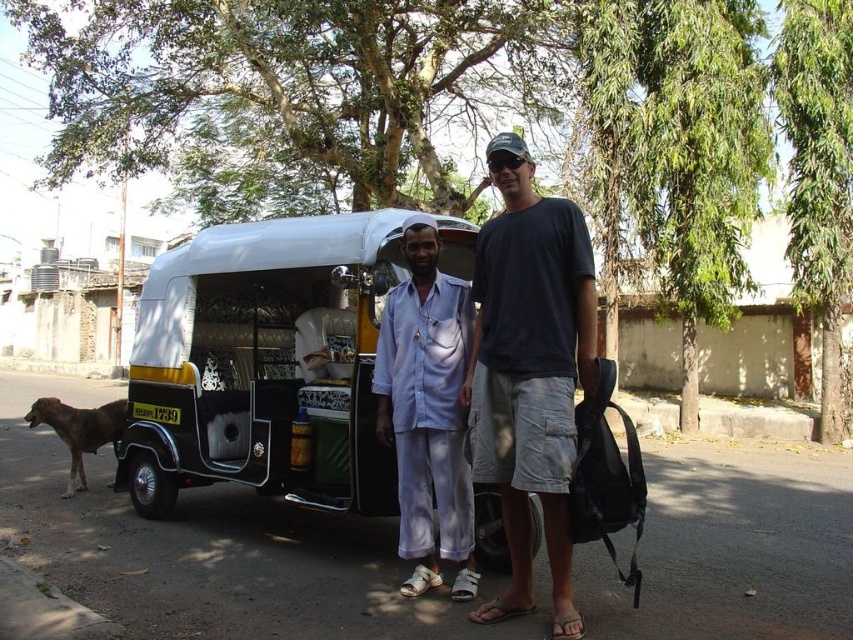
Does white matte auto-rickshaw at center appear over dark gray t-shirt at center?

Incorrect, white matte auto-rickshaw at center is not positioned above dark gray t-shirt at center.

Between white matte auto-rickshaw at center and dark gray t-shirt at center, which one has less height?

white matte auto-rickshaw at center is shorter.

Which is behind, point (318, 413) or point (474, 449)?

Point (318, 413)

You are a GUI agent. You are given a task and a screenshot of the screen. Output one action in this format:
    pyautogui.click(x=<x>, y=<y>)
    Task: Click on the white matte auto-rickshaw at center
    The image size is (853, 640).
    Given the screenshot: What is the action you would take?
    pyautogui.click(x=264, y=364)

Does dark gray t-shirt at center appear on the left side of light blue cotton shirt at center?

In fact, dark gray t-shirt at center is to the right of light blue cotton shirt at center.

Is dark gray t-shirt at center taller than light blue cotton shirt at center?

Yes.

Is point (570, 236) farther from camera compared to point (395, 305)?

That is False.

What are the coordinates of `dark gray t-shirt at center` in the screenshot? It's located at (529, 371).

I want to click on dark gray t-shirt at center, so click(529, 371).

Does dark gray t-shirt at center come in front of brown fur dog at lower left?

That is True.

The width and height of the screenshot is (853, 640). What do you see at coordinates (529, 371) in the screenshot?
I see `dark gray t-shirt at center` at bounding box center [529, 371].

I want to click on dark gray t-shirt at center, so click(x=529, y=371).